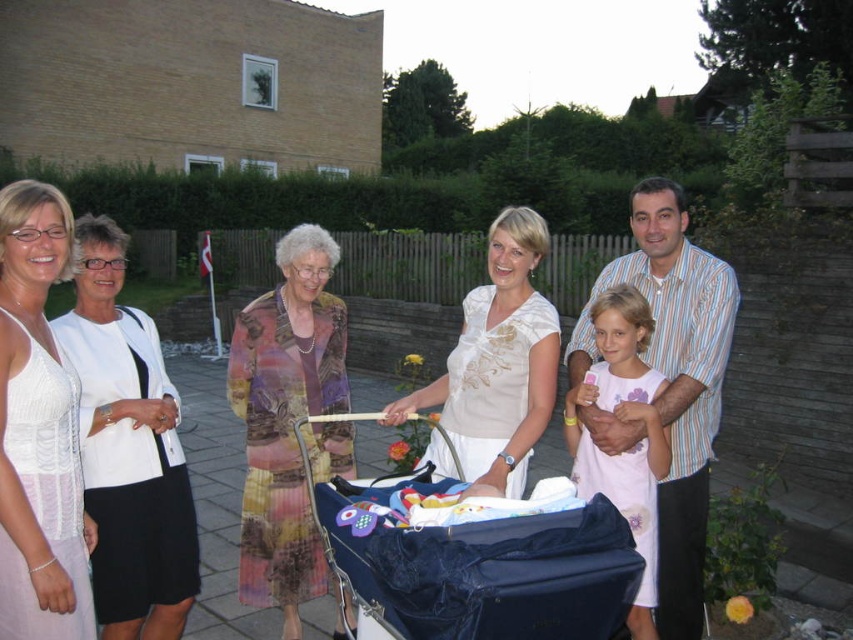
Is matte floral dress at center above white embroidered blouse at center?

Actually, matte floral dress at center is below white embroidered blouse at center.

Who is positioned more to the left, matte floral dress at center or white embroidered blouse at center?

Positioned to the left is white embroidered blouse at center.

Between point (575, 353) and point (498, 280), which one is positioned in front?

Positioned in front is point (498, 280).

Where is `matte floral dress at center`? The height and width of the screenshot is (640, 853). matte floral dress at center is located at coordinates (511, 371).

Between blue fabric baby carriage at center and white textured blouse at left, which one is positioned higher?

white textured blouse at left is above.

Is blue fabric baby carriage at center thinner than white textured blouse at left?

In fact, blue fabric baby carriage at center might be wider than white textured blouse at left.

The image size is (853, 640). Describe the element at coordinates (479, 563) in the screenshot. I see `blue fabric baby carriage at center` at that location.

At what (x,y) coordinates should I click in order to perform the action: click on blue fabric baby carriage at center. Please return your answer as a coordinate pair (x, y). Looking at the image, I should click on (479, 563).

Does white lace dress at left appear under white embroidered blouse at center?

Yes.

Which is in front, point (74, 380) or point (494, 426)?

Point (74, 380) is more forward.

Locate an element on the screen. white lace dress at left is located at coordinates (38, 429).